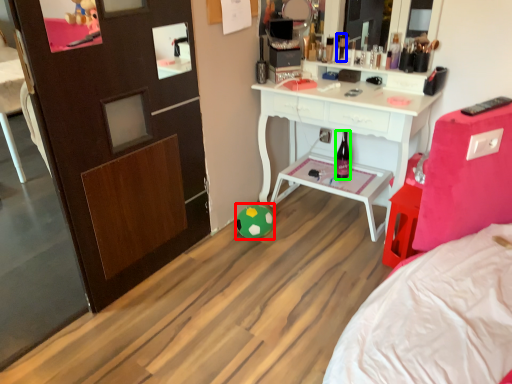
Question: Considering the real-world distances, which object is farthest from toy (highlighted by a red box)? toiletry (highlighted by a blue box) or bottle (highlighted by a green box)?

Choices:
 (A) toiletry
 (B) bottle

Answer: (A)